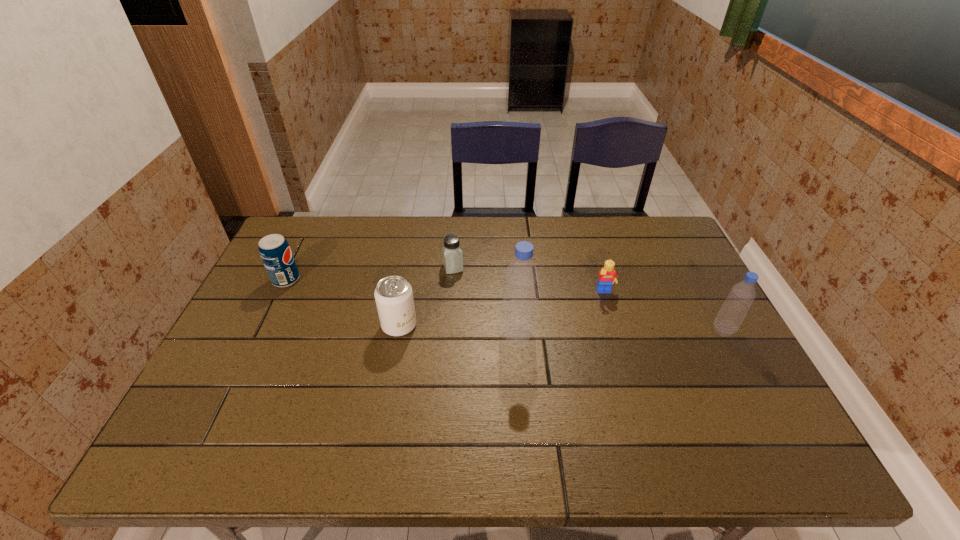
Locate an element on the screen. This screenshot has width=960, height=540. vacant space located 0.200m on the back of the fourth object from left to right is located at coordinates (513, 275).

This screenshot has width=960, height=540. I want to click on vacant area situated 0.200m on the back of the shorter bottle, so click(x=693, y=274).

I want to click on free space located on the front of the fourth object from right to left, so click(x=449, y=320).

At what (x,y) coordinates should I click in order to perform the action: click on free space located 0.330m on the front of the farther soda can. Please return your answer as a coordinate pair (x, y). Image resolution: width=960 pixels, height=540 pixels. Looking at the image, I should click on (236, 382).

At what (x,y) coordinates should I click in order to perform the action: click on free spot located 0.220m on the left of the right soda can. Please return your answer as a coordinate pair (x, y). The width and height of the screenshot is (960, 540). Looking at the image, I should click on (301, 326).

This screenshot has width=960, height=540. Identify the location of vacant space located on the face of the second object from right to left. (633, 386).

The image size is (960, 540). What are the coordinates of `object located at the left edge` in the screenshot? It's located at (275, 252).

Identify the location of object that is at the right edge. The image size is (960, 540). (733, 311).

The width and height of the screenshot is (960, 540). I want to click on vacant space at the far edge of the desktop, so click(522, 217).

This screenshot has height=540, width=960. In order to click on free space at the near edge of the desktop in this screenshot , I will do `click(508, 391)`.